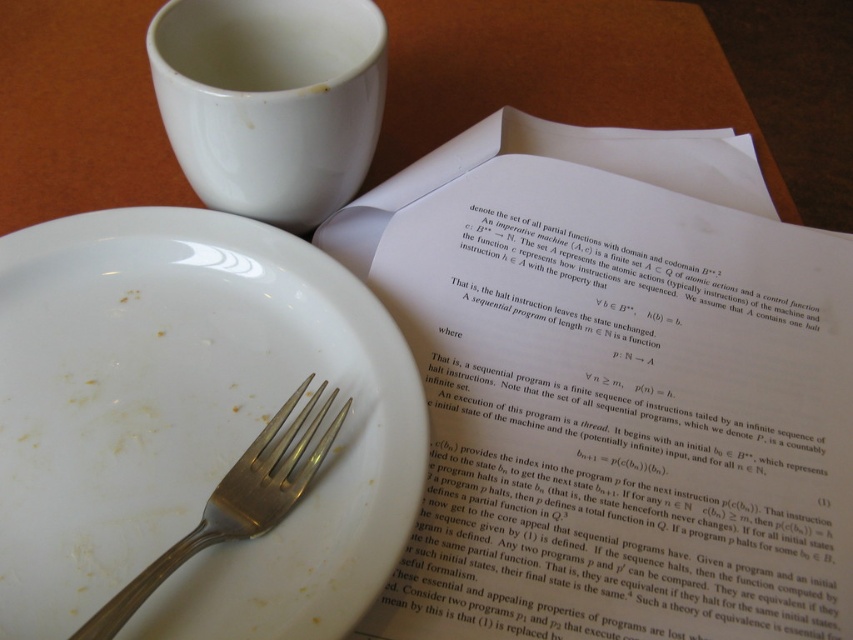
Question: Observing the image, what is the correct spatial positioning of white glossy plate at lower left in reference to satin silver fork at lower left?

Choices:
 (A) left
 (B) right

Answer: (A)

Question: Observing the image, what is the correct spatial positioning of white glossy plate at lower left in reference to white glossy mug at upper center?

Choices:
 (A) above
 (B) below

Answer: (B)

Question: Which object is the closest to the white glossy plate at lower left?

Choices:
 (A) satin silver fork at lower left
 (B) white paper at upper center
 (C) white glossy mug at upper center

Answer: (A)

Question: Considering the real-world distances, which object is closest to the satin silver fork at lower left?

Choices:
 (A) white glossy mug at upper center
 (B) white glossy plate at lower left

Answer: (B)

Question: Is white paper at upper center above white glossy mug at upper center?

Choices:
 (A) yes
 (B) no

Answer: (B)

Question: Based on their relative distances, which object is farther from the white glossy mug at upper center?

Choices:
 (A) satin silver fork at lower left
 (B) white glossy plate at lower left

Answer: (A)